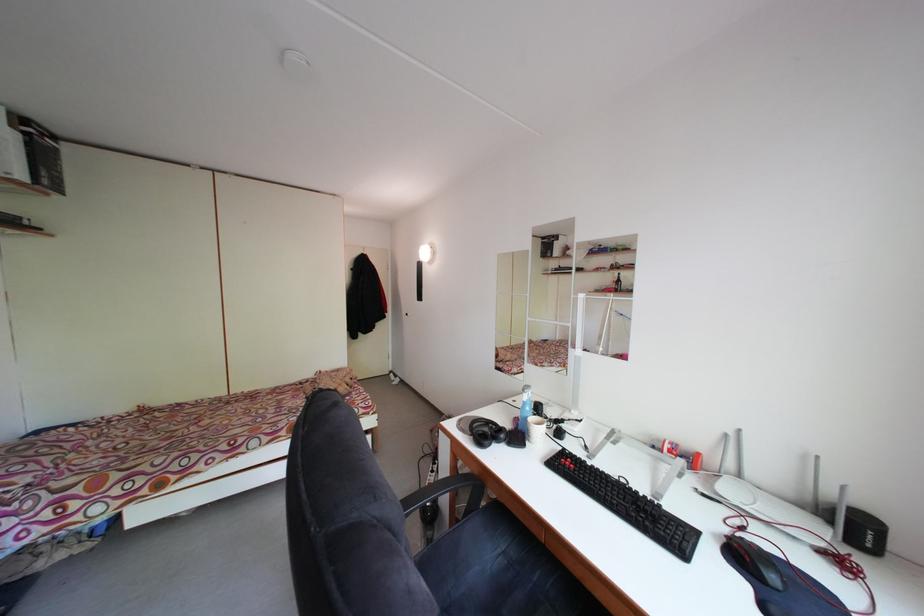
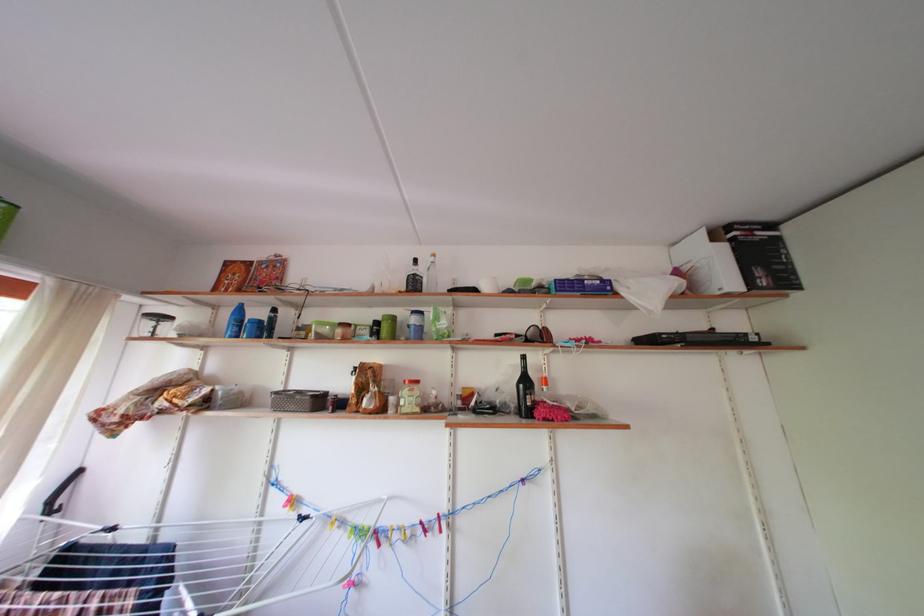
Locate, in the second image, the point that corresponds to (x=53, y=180) in the first image.

(768, 278)